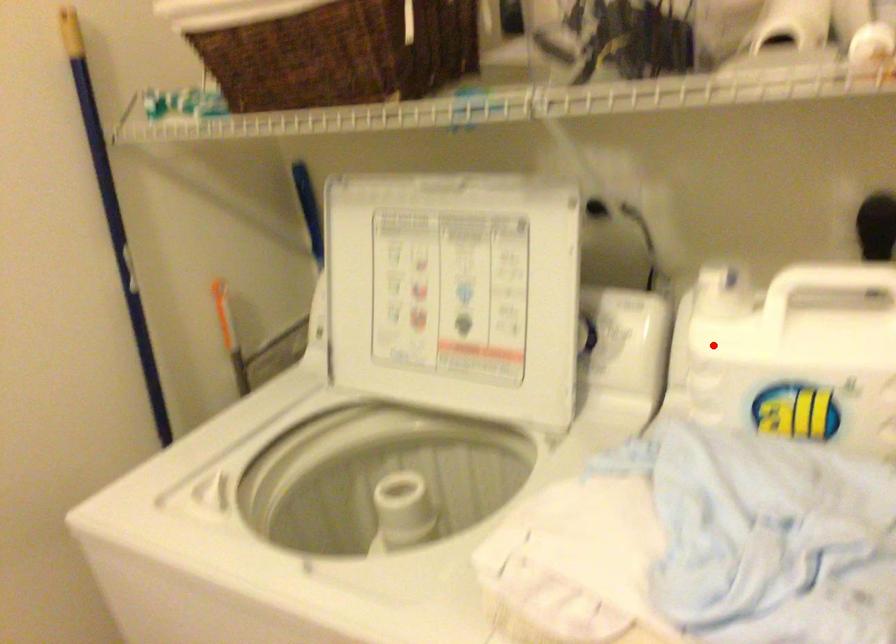
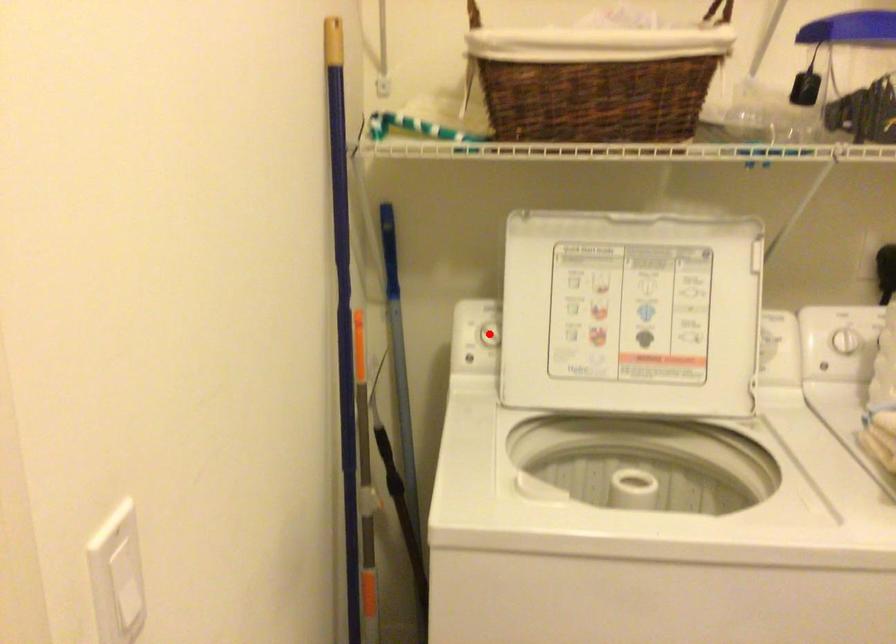
I am providing you with two images of the same scene from different viewpoints. A red point is marked on the first image and another point is marked on the second image. Are the points marked in image1 and image2 representing the same 3D position?

No